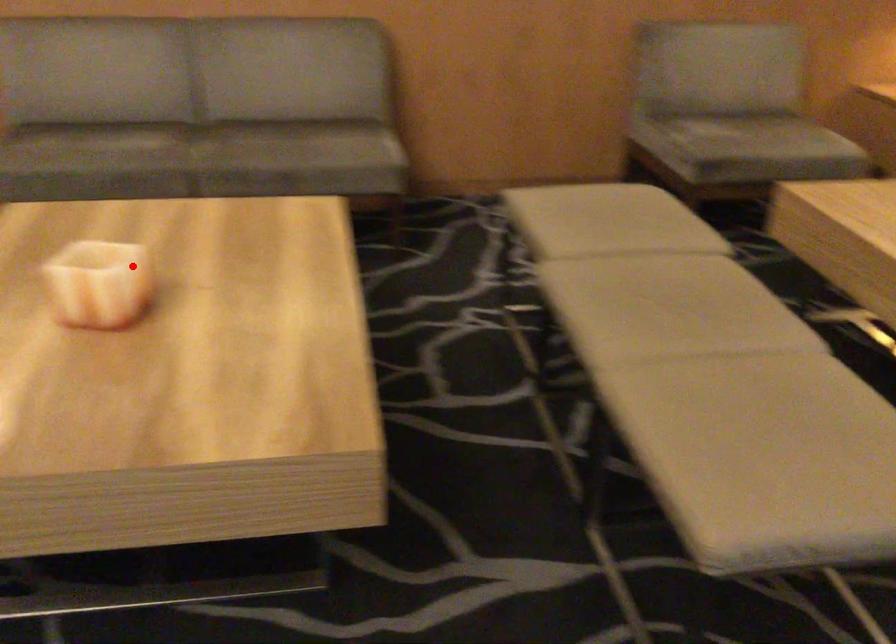
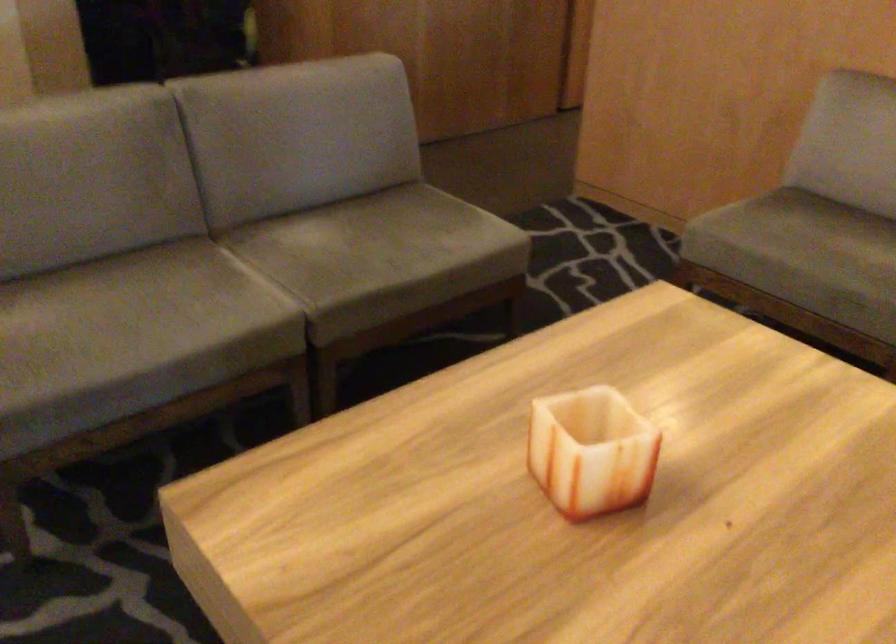
Question: A red point is marked in image1. In image2, is the corresponding 3D point closer to the camera or farther? Reply with the corresponding letter.

Choices:
 (A) The corresponding 3D point is closer.
 (B) The corresponding 3D point is farther.

Answer: (A)